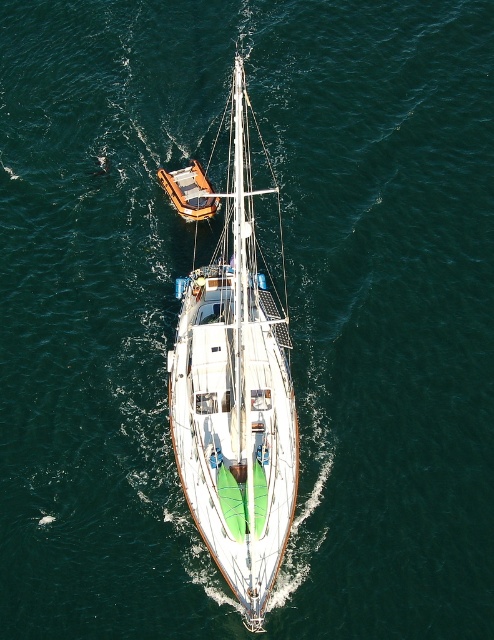
Does point (255, 387) lie behind point (164, 186)?

That is False.

Does white glossy sailboat at center lie behind orange matte dinghy at upper center?

No, it is not.

Between point (242, 152) and point (198, 205), which one is positioned behind?

Positioned behind is point (198, 205).

This screenshot has width=494, height=640. I want to click on white glossy sailboat at center, so click(236, 392).